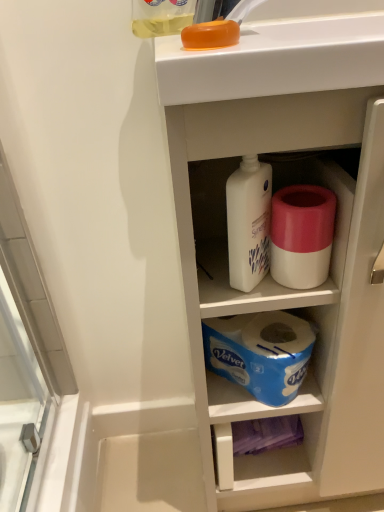
Question: From the image's perspective, is translucent yellow liquid at upper center located above or below white plastic cabinet at upper center?

Choices:
 (A) below
 (B) above

Answer: (B)

Question: Is translucent yellow liquid at upper center to the left or to the right of white plastic cabinet at upper center in the image?

Choices:
 (A) left
 (B) right

Answer: (A)

Question: Considering the real-world distances, which object is farthest from the translucent yellow liquid at upper center?

Choices:
 (A) white matte toilet paper at center
 (B) white plastic cabinet at upper center

Answer: (B)

Question: Estimate the real-world distances between objects in this image. Which object is farther from the translucent yellow liquid at upper center?

Choices:
 (A) white plastic cabinet at upper center
 (B) white matte toilet paper at center

Answer: (A)